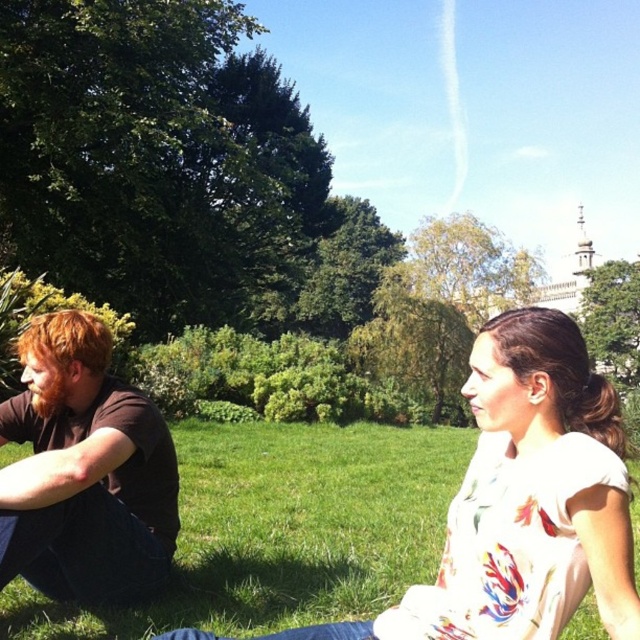
Does white floral shirt at center appear under brown cotton shirt at left?

Correct, white floral shirt at center is located below brown cotton shirt at left.

Can you confirm if white floral shirt at center is taller than brown cotton shirt at left?

Yes, white floral shirt at center is taller than brown cotton shirt at left.

This screenshot has width=640, height=640. Identify the location of white floral shirt at center. (525, 500).